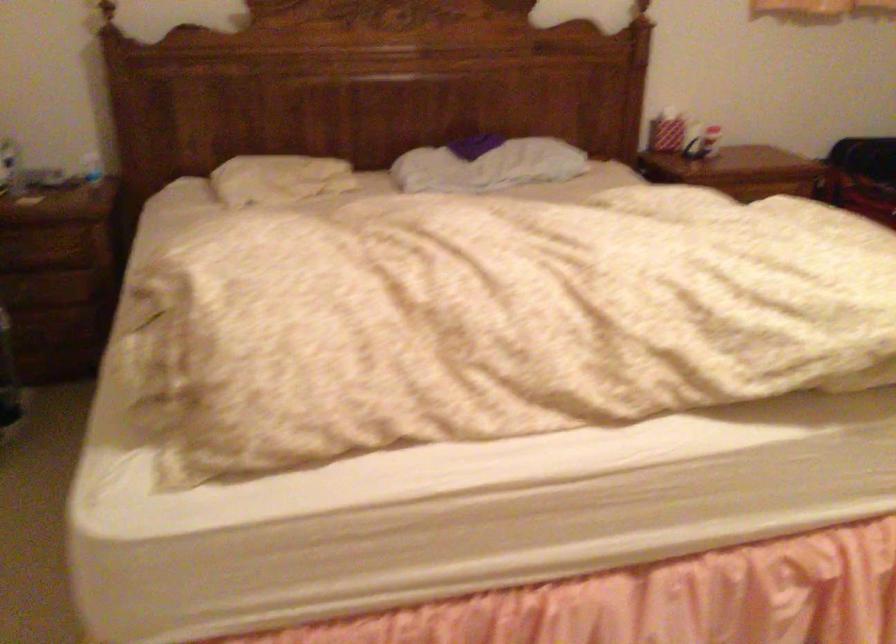
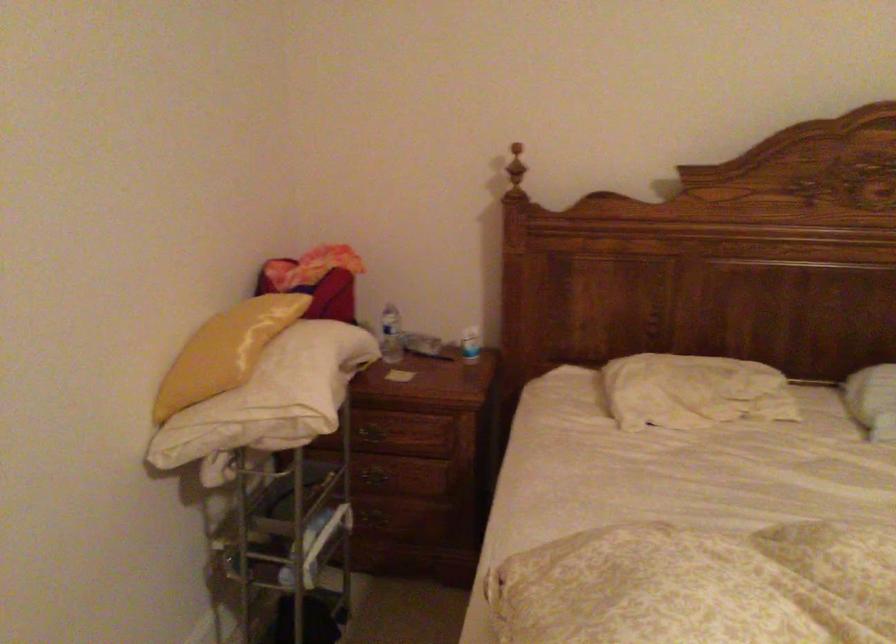
Question: The camera is either moving clockwise (left) or counter-clockwise (right) around the object. The first image is from the beginning of the video and the second image is from the end. Is the camera moving left or right when shooting the video?

Choices:
 (A) Left
 (B) Right

Answer: (B)